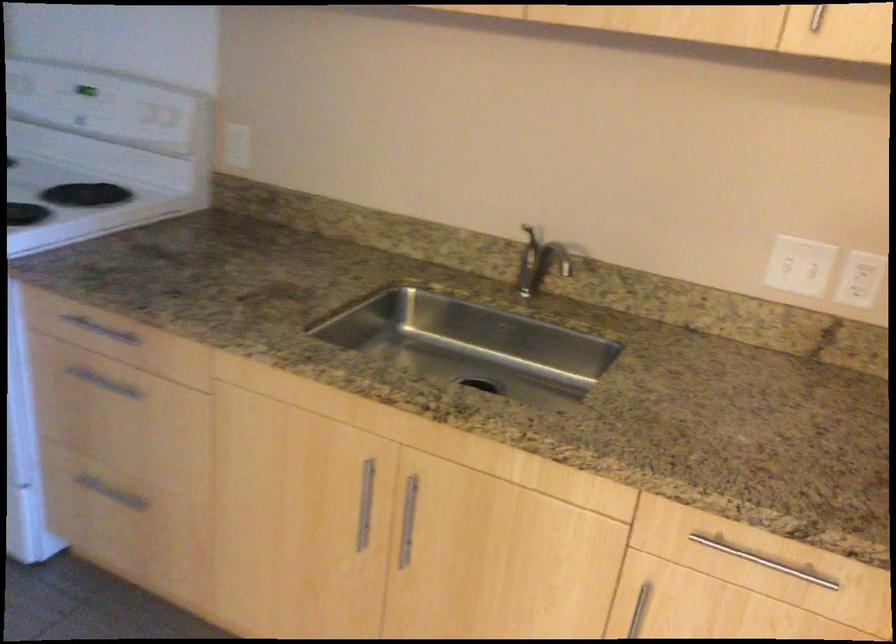
Locate an element on the screen. This screenshot has width=896, height=644. metal bar handle is located at coordinates (763, 562).